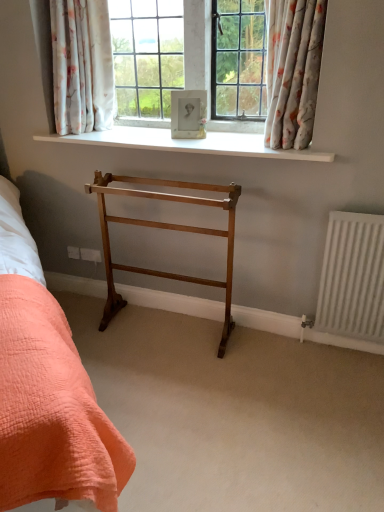
The image size is (384, 512). Find the location of `vacant area that is situated to the right of floral fabric curtain at upper center, marked as the 1th curtain in a left-to-right arrangement`. vacant area that is situated to the right of floral fabric curtain at upper center, marked as the 1th curtain in a left-to-right arrangement is located at coordinates (143, 134).